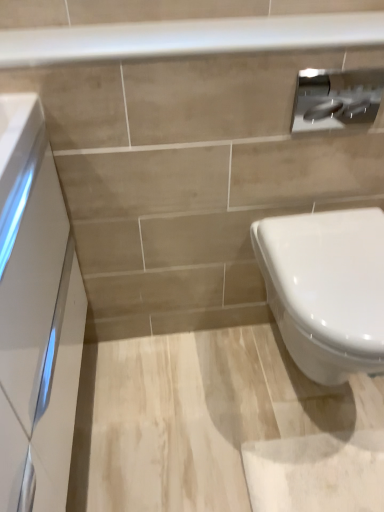
Question: Can you confirm if white glossy cabinet at left is smaller than satin silver toilet paper at upper right?

Choices:
 (A) yes
 (B) no

Answer: (B)

Question: Is white glossy cabinet at left far away from satin silver toilet paper at upper right?

Choices:
 (A) no
 (B) yes

Answer: (A)

Question: From a real-world perspective, does white glossy cabinet at left stand above satin silver toilet paper at upper right?

Choices:
 (A) no
 (B) yes

Answer: (A)

Question: Is white glossy cabinet at left beside satin silver toilet paper at upper right?

Choices:
 (A) yes
 (B) no

Answer: (B)

Question: Could you tell me if white glossy cabinet at left is facing satin silver toilet paper at upper right?

Choices:
 (A) yes
 (B) no

Answer: (A)

Question: Is satin silver toilet paper at upper right wider or thinner than white glossy toilet at lower right?

Choices:
 (A) thin
 (B) wide

Answer: (A)

Question: From a real-world perspective, is satin silver toilet paper at upper right positioned above or below white glossy toilet at lower right?

Choices:
 (A) above
 (B) below

Answer: (A)

Question: Would you say satin silver toilet paper at upper right is inside or outside white glossy toilet at lower right?

Choices:
 (A) inside
 (B) outside

Answer: (B)

Question: Considering the positions of satin silver toilet paper at upper right and white glossy toilet at lower right in the image, is satin silver toilet paper at upper right taller or shorter than white glossy toilet at lower right?

Choices:
 (A) short
 (B) tall

Answer: (A)

Question: From a real-world perspective, relative to white glossy balustrade at upper center, is satin silver toilet paper at upper right vertically above or below?

Choices:
 (A) above
 (B) below

Answer: (B)

Question: Considering the positions of satin silver toilet paper at upper right and white glossy balustrade at upper center in the image, is satin silver toilet paper at upper right taller or shorter than white glossy balustrade at upper center?

Choices:
 (A) short
 (B) tall

Answer: (B)

Question: In the image, is satin silver toilet paper at upper right positioned in front of or behind white glossy balustrade at upper center?

Choices:
 (A) behind
 (B) front

Answer: (A)

Question: Visually, is satin silver toilet paper at upper right positioned to the left or to the right of white glossy balustrade at upper center?

Choices:
 (A) left
 (B) right

Answer: (B)

Question: In terms of size, does white glossy cabinet at left appear bigger or smaller than white glossy toilet at lower right?

Choices:
 (A) big
 (B) small

Answer: (A)

Question: Is point (57, 431) closer or farther from the camera than point (291, 226)?

Choices:
 (A) farther
 (B) closer

Answer: (B)